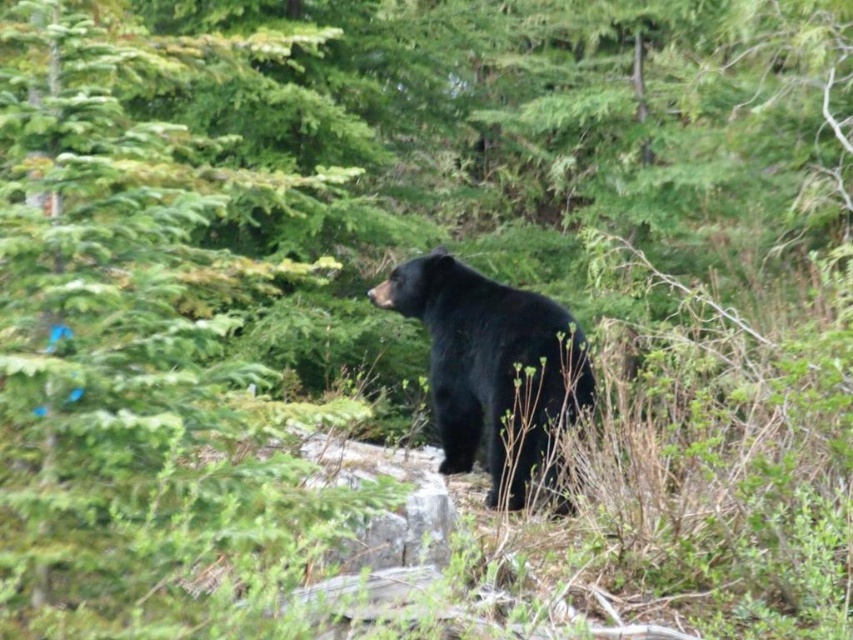
You are a hiker who wants to take a photo of the black furry bear at center without getting too close. The camera you have can focus on objects up to 10 feet away. Is the green leafy tree at center in the way of taking the photo?

The green leafy tree at center is 9.20 feet away from the black furry bear at center. Since the camera can focus up to 10 feet, the distance between them is within the camera range. However, the tree is positioned between you and the bear, so it would block the view. You need to move to a different angle to avoid the tree.

You are a hiker who wants to take a photo of the black furry bear at center without getting too close. You notice a green leafy tree at center in the way. Which object should you move closer to in order to frame the bear properly?

The green leafy tree at center is closer to the viewer than the black furry bear at center. To frame the bear properly, you should move closer to the black furry bear at center so it appears larger in the photo while keeping the tree in the background.

You are a hiker who wants to take a photo of the black furry bear at center without getting too close. You notice a green leafy tree at center in the way. Can you position yourself so that the tree doesn

The green leafy tree at center is bigger than the black furry bear at center, so if you position yourself to the side of the tree, you might still get a clear shot of the bear without the tree blocking the view.